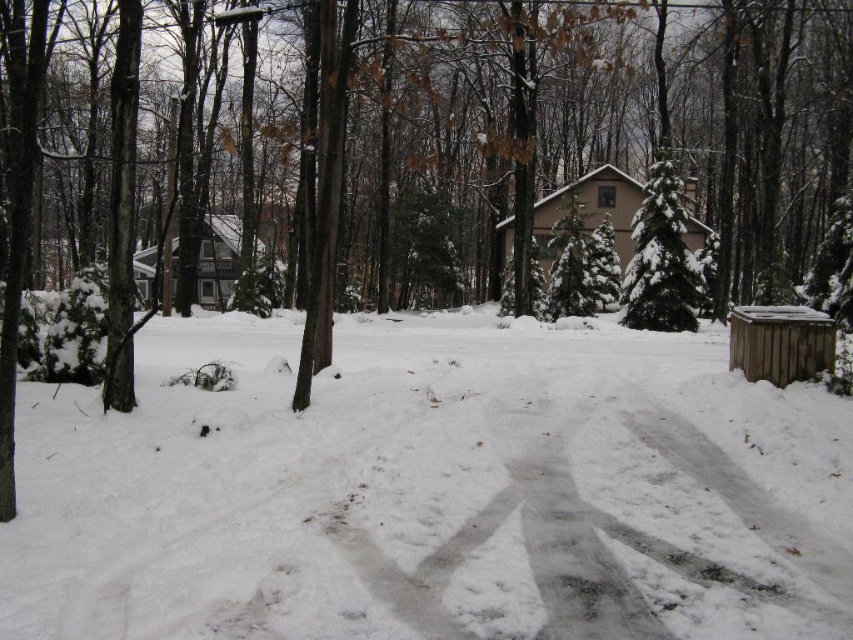
The image size is (853, 640). In order to click on white fluffy snow at center in this screenshot , I will do `click(432, 490)`.

Which is behind, point (136, 513) or point (691, 301)?

The point (691, 301) is behind.

Locate an element on the screen. white fluffy snow at center is located at coordinates (432, 490).

Does green textured evergreen at center lie in front of brown wooden shed at right?

No, it is behind brown wooden shed at right.

Measure the distance between point [670,262] and camera.

Point [670,262] is 25.12 meters away from camera.

Locate an element on the screen. Image resolution: width=853 pixels, height=640 pixels. green textured evergreen at center is located at coordinates (660, 257).